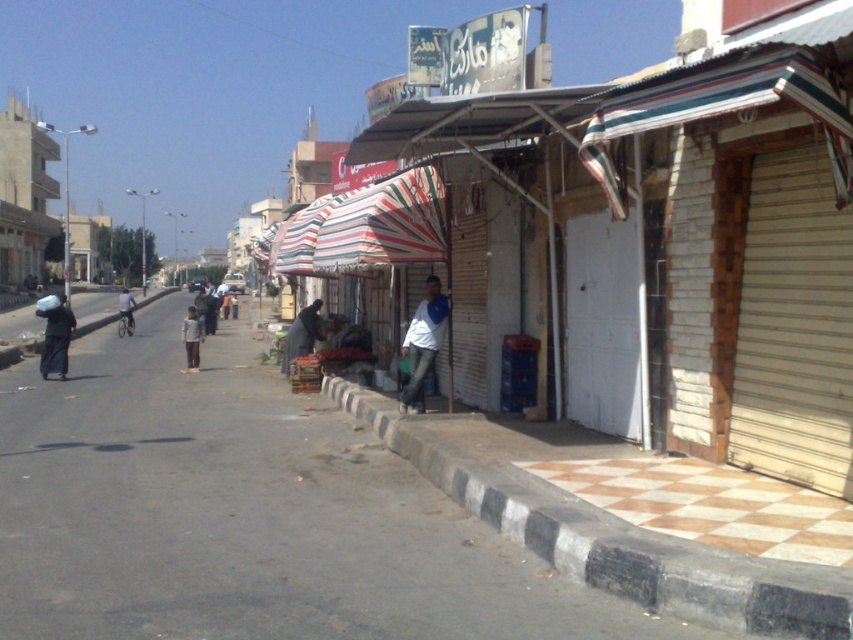
You are a delivery person who needs to place a package on the checkerboard tile pavement at lower right and the dark blue fabric at center. Which surface is shorter in height and thus safer for placing a heavy box?

The checkerboard tile pavement at lower right is shorter than the dark blue fabric at center, so it is safer to place the heavy box there as it requires less height adjustment.